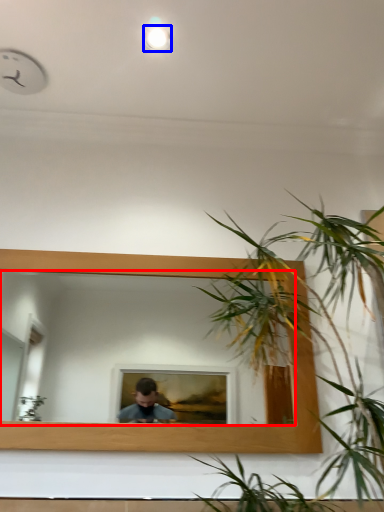
Question: Which object appears farthest to the camera in this image, mirror (highlighted by a red box) or light (highlighted by a blue box)?

Choices:
 (A) mirror
 (B) light

Answer: (B)